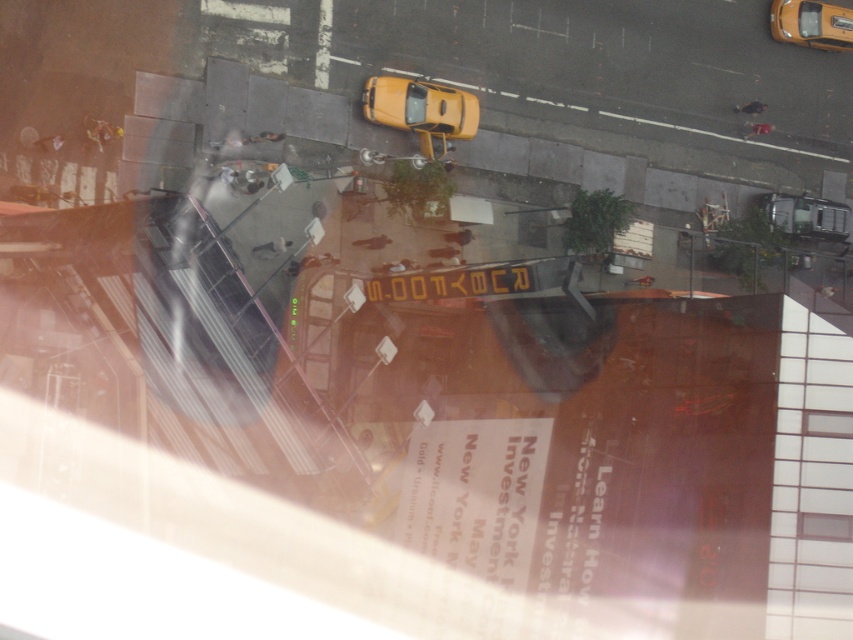
Question: From the image, what is the correct spatial relationship of yellow matte taxi at center in relation to yellow matte taxi at upper right?

Choices:
 (A) left
 (B) right

Answer: (A)

Question: Estimate the real-world distances between objects in this image. Which object is farther from the metallic silver car at lower right?

Choices:
 (A) yellow matte taxi at center
 (B) yellow matte taxi at upper right

Answer: (A)

Question: Can you confirm if yellow matte taxi at center is wider than metallic silver car at lower right?

Choices:
 (A) no
 (B) yes

Answer: (B)

Question: Which of the following is the farthest from the observer?

Choices:
 (A) (770, 198)
 (B) (811, 4)

Answer: (A)

Question: Which point is farther to the camera?

Choices:
 (A) pos(815,200)
 (B) pos(418,83)

Answer: (A)

Question: Is yellow matte taxi at upper right positioned before metallic silver car at lower right?

Choices:
 (A) yes
 (B) no

Answer: (A)